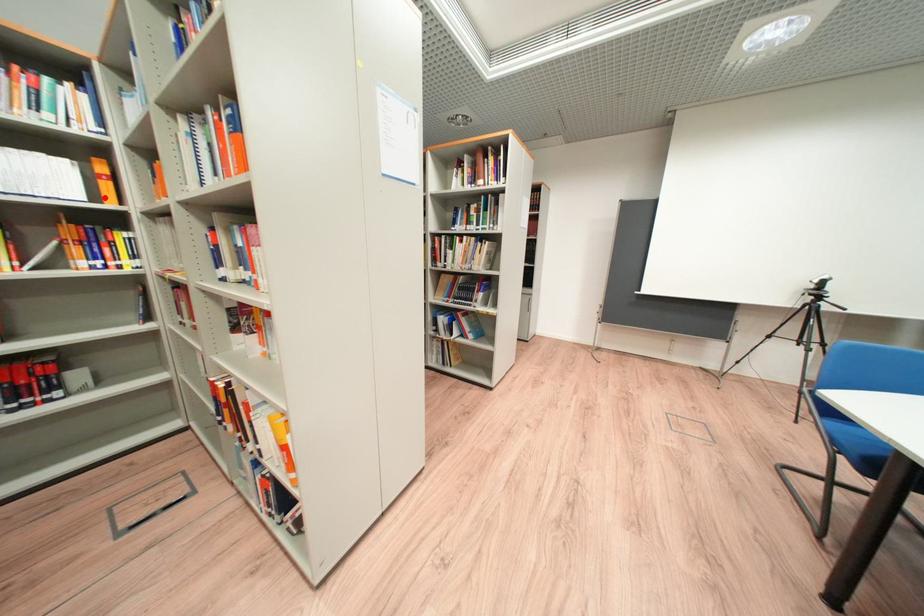
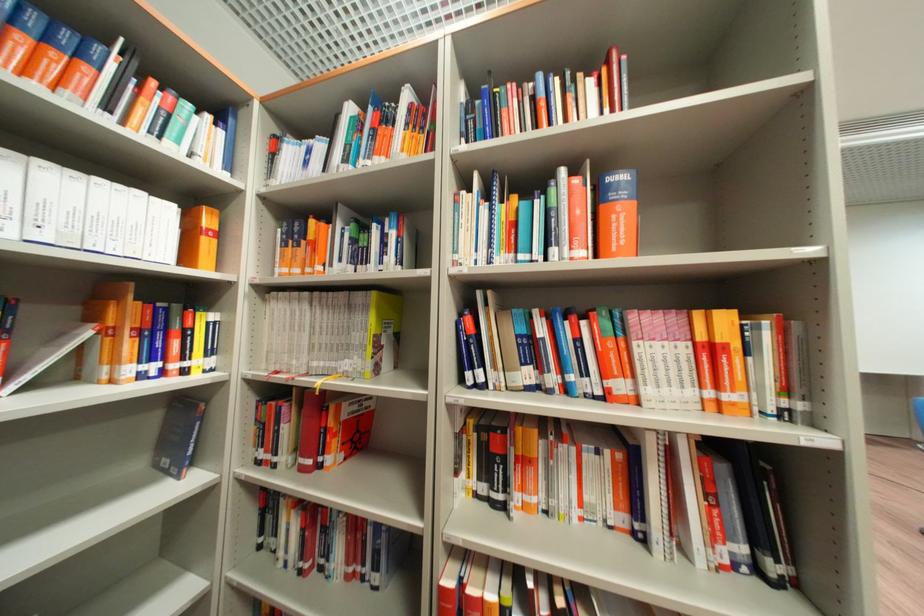
The point at the highlighted location is marked in the first image. Where is the corresponding point in the second image?

(198, 260)